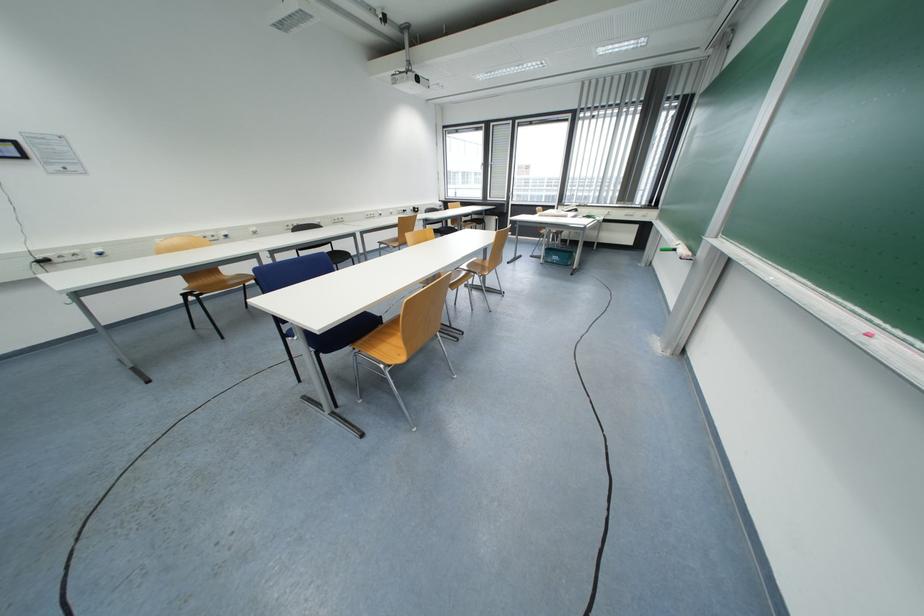
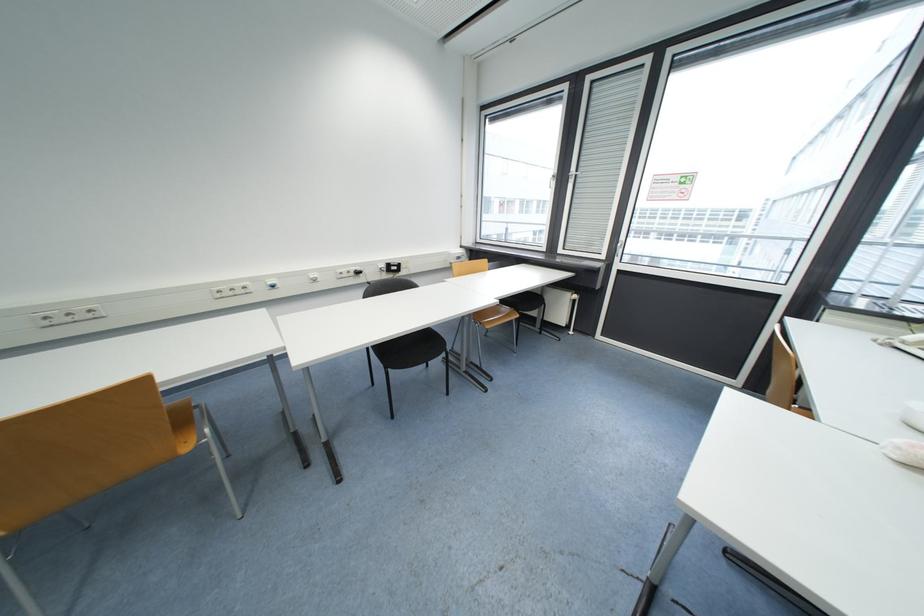
Where in the second image is the point corresponding to point (496, 126) from the first image?

(593, 81)